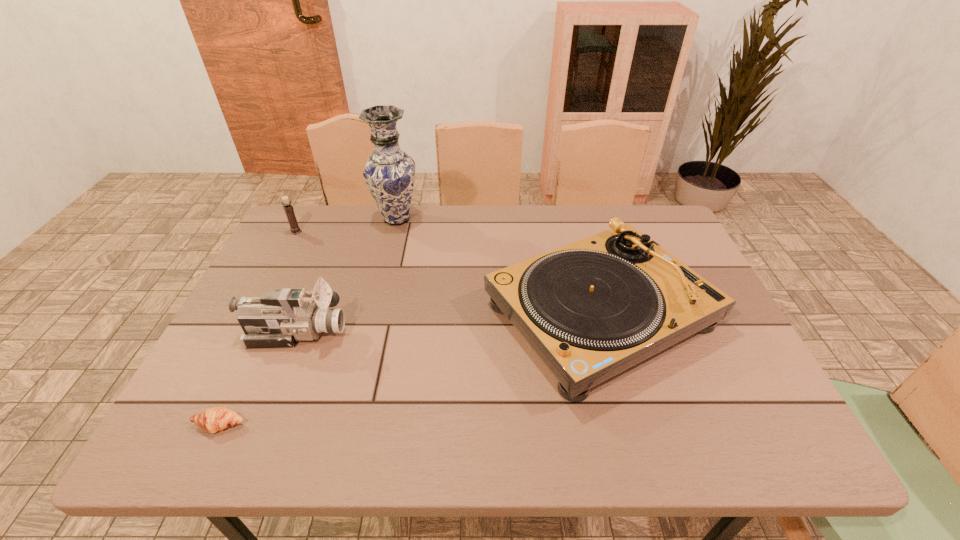
Where is `vase that is at the far edge`? The image size is (960, 540). vase that is at the far edge is located at coordinates (389, 172).

Identify the location of record player present at the far edge. This screenshot has height=540, width=960. (591, 309).

Find the location of a particular element. candle holder at the far edge is located at coordinates (294, 228).

At what (x,y) coordinates should I click in order to perform the action: click on object located at the near edge. Please return your answer as a coordinate pair (x, y). Looking at the image, I should click on (215, 419).

The width and height of the screenshot is (960, 540). In order to click on camcorder present at the left edge in this screenshot , I will do `click(279, 318)`.

This screenshot has height=540, width=960. What are the coordinates of `candle holder that is at the left edge` in the screenshot? It's located at (294, 228).

Locate an element on the screen. Image resolution: width=960 pixels, height=540 pixels. pastry at the left edge is located at coordinates (215, 419).

You are a GUI agent. You are given a task and a screenshot of the screen. Output one action in this format:
    pyautogui.click(x=<x>, y=<y>)
    Task: Click on the object at the right edge
    
    Given the screenshot: What is the action you would take?
    pyautogui.click(x=591, y=309)

The image size is (960, 540). I want to click on object present at the far left corner, so click(294, 228).

Identify the location of object that is at the near left corner. (215, 419).